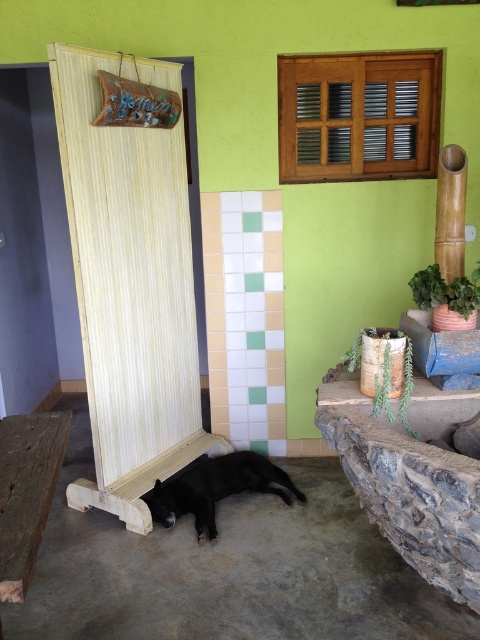
You are standing in the rustic indoor space with lime green walls. You see a wooden screen at left and a point marked at coordinates (130, 285). Is the point closer to the wooden screen at left or the window?

The point (130, 285) corresponds to the wooden screen at left, so it is closer to the wooden screen at left.

From the picture: You are a person trying to sit on the rustic wooden bench at lower left while keeping the black matte dog at lower center on your right side. Is there enough space for both?

The rustic wooden bench at lower left is thinner than the black matte dog at lower center, so there may not be enough space to sit on the bench while keeping the dog on your right side.

You are a visitor entering the rustic indoor space and want to know if the wooden screen at left can block the view of the black matte dog at lower center from the doorway. Can it?

The wooden screen at left is much taller than the black matte dog at lower center. Since the screen is taller, it can potentially block the view of the black matte dog at lower center if positioned appropriately between the doorway and the dog.